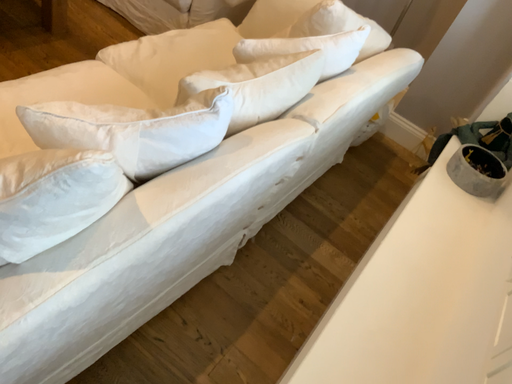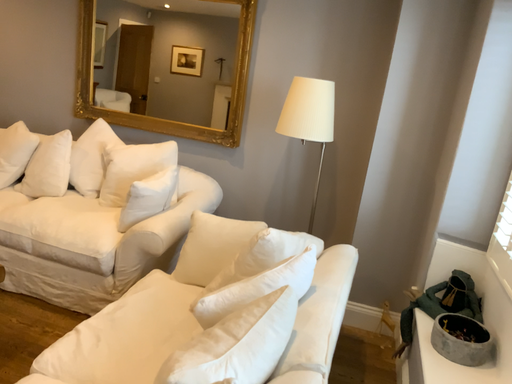
Question: Which way did the camera rotate in the video?

Choices:
 (A) rotated upward
 (B) rotated downward

Answer: (A)